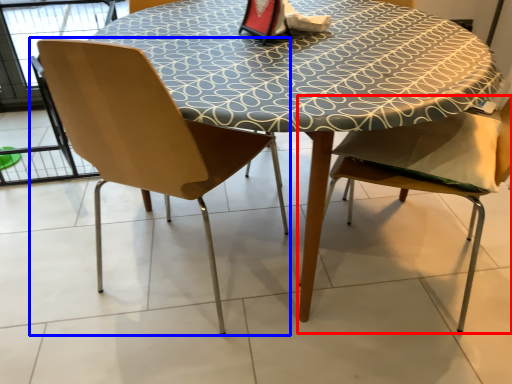
Question: Which point is closer to the camera, chair (highlighted by a red box) or chair (highlighted by a blue box)?

Choices:
 (A) chair
 (B) chair

Answer: (A)